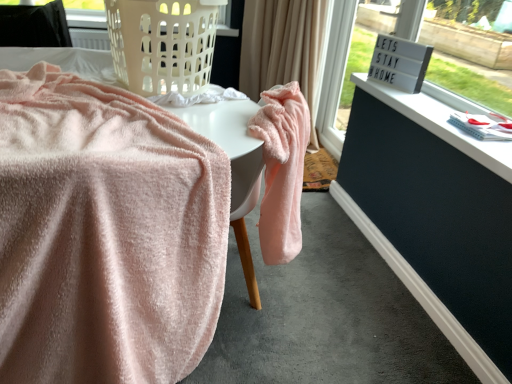
Question: Would you say velvet pink table at center, which is the 1th table from right to left, is outside soft pink towel at center, arranged as the 1th table when viewed from the left?

Choices:
 (A) yes
 (B) no

Answer: (B)

Question: From the image's perspective, is velvet pink table at center, which is the 1th table from right to left, beneath soft pink towel at center, arranged as the 1th table when viewed from the left?

Choices:
 (A) yes
 (B) no

Answer: (B)

Question: Can you confirm if velvet pink table at center, which is the 1th table from right to left, is thinner than soft pink towel at center, arranged as the 1th table when viewed from the left?

Choices:
 (A) no
 (B) yes

Answer: (B)

Question: Is velvet pink table at center, the second table viewed from the left, directly adjacent to soft pink towel at center, the 2th table viewed from the right?

Choices:
 (A) no
 (B) yes

Answer: (B)

Question: Can you confirm if velvet pink table at center, which is the 1th table from right to left, is wider than soft pink towel at center, the 2th table viewed from the right?

Choices:
 (A) yes
 (B) no

Answer: (B)

Question: Considering the positions of point (31, 26) and point (134, 6), is point (31, 26) closer or farther from the camera than point (134, 6)?

Choices:
 (A) closer
 (B) farther

Answer: (B)

Question: From the image's perspective, is black fabric at upper left located above or below white plastic laundry basket at upper left?

Choices:
 (A) below
 (B) above

Answer: (B)

Question: Relative to white plastic laundry basket at upper left, is black fabric at upper left in front or behind?

Choices:
 (A) behind
 (B) front

Answer: (A)

Question: Is black fabric at upper left bigger or smaller than white plastic laundry basket at upper left?

Choices:
 (A) big
 (B) small

Answer: (B)

Question: Considering the positions of soft pink towel at center, the 2th table viewed from the right, and beige fabric curtain at upper center in the image, is soft pink towel at center, the 2th table viewed from the right, wider or thinner than beige fabric curtain at upper center?

Choices:
 (A) thin
 (B) wide

Answer: (B)

Question: In terms of height, does soft pink towel at center, arranged as the 1th table when viewed from the left, look taller or shorter compared to beige fabric curtain at upper center?

Choices:
 (A) short
 (B) tall

Answer: (A)

Question: From the image's perspective, is soft pink towel at center, arranged as the 1th table when viewed from the left, located above or below beige fabric curtain at upper center?

Choices:
 (A) below
 (B) above

Answer: (A)

Question: From a real-world perspective, relative to beige fabric curtain at upper center, is soft pink towel at center, arranged as the 1th table when viewed from the left, vertically above or below?

Choices:
 (A) above
 (B) below

Answer: (B)

Question: Considering the relative positions of white plastic laundry basket at upper left and beige fabric curtain at upper center in the image provided, is white plastic laundry basket at upper left to the left or to the right of beige fabric curtain at upper center?

Choices:
 (A) right
 (B) left

Answer: (B)

Question: Is white plastic laundry basket at upper left in front of or behind beige fabric curtain at upper center in the image?

Choices:
 (A) front
 (B) behind

Answer: (A)